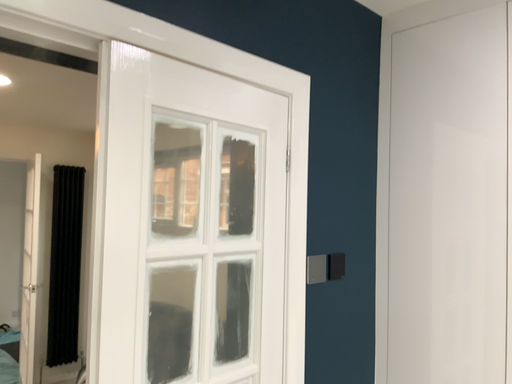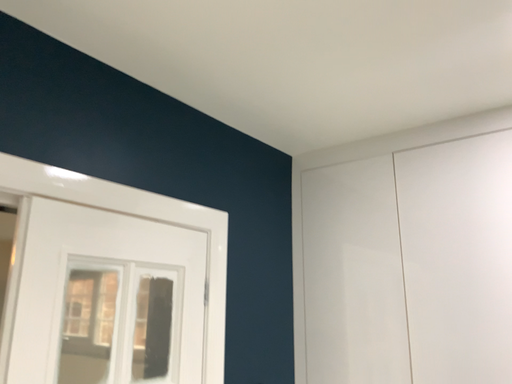
Question: How did the camera likely rotate when shooting the video?

Choices:
 (A) rotated left
 (B) rotated right

Answer: (B)